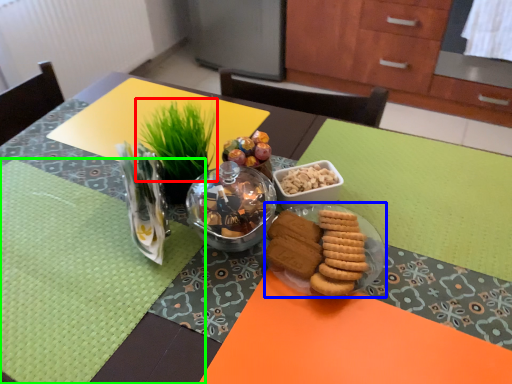
Question: Based on their relative distances, which object is nearer to grass (highlighted by a red box)? Choose from glass plate (highlighted by a blue box) and place mat (highlighted by a green box).

Choices:
 (A) glass plate
 (B) place mat

Answer: (B)